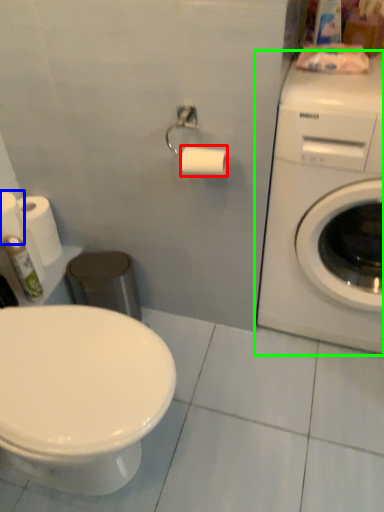
Question: Which is nearer to the toilet paper (highlighted by a red box)? toilet paper (highlighted by a blue box) or washing machine (highlighted by a green box).

Choices:
 (A) toilet paper
 (B) washing machine

Answer: (B)